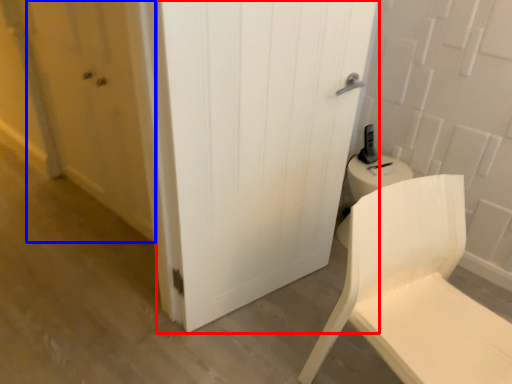
Question: Among these objects, which one is farthest to the camera, door (highlighted by a red box) or screen door (highlighted by a blue box)?

Choices:
 (A) door
 (B) screen door

Answer: (B)